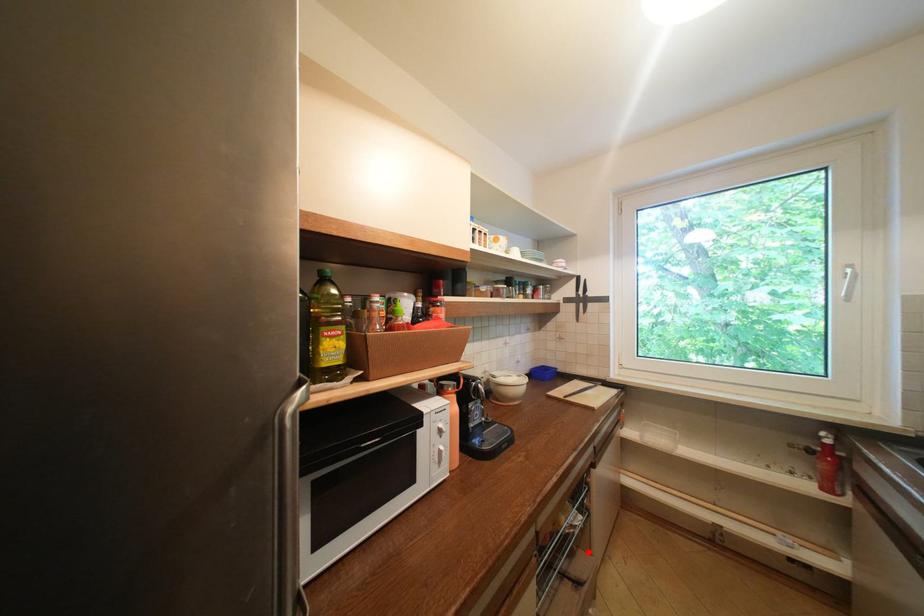
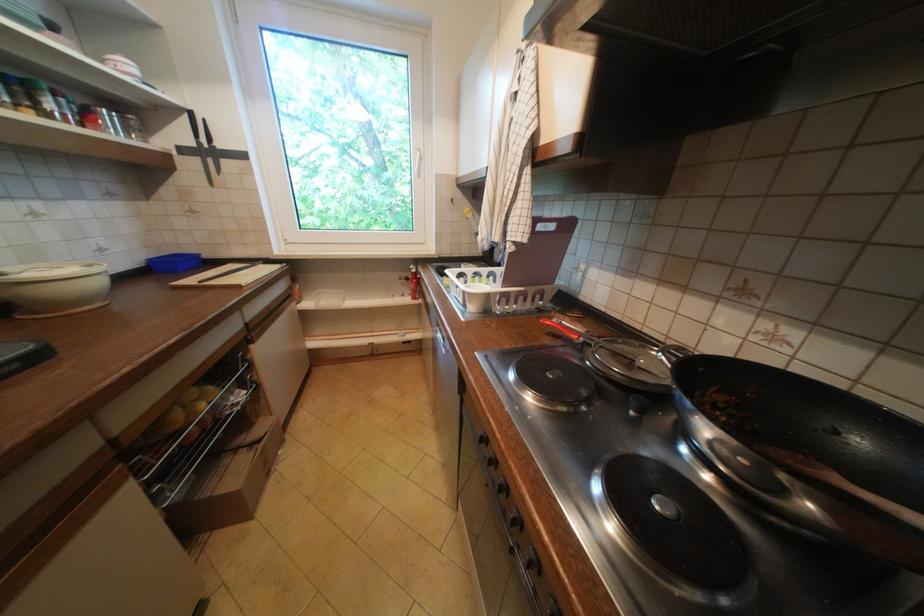
Question: I am providing you with two images of the same scene from different viewpoints. Image1 has a red point marked. In image2, the corresponding 3D location appears at what relative position? Reply with the corresponding letter.

Choices:
 (A) Closer
 (B) Farther

Answer: (A)